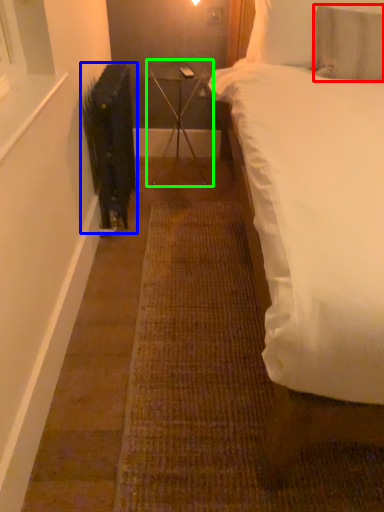
Question: Considering the real-world distances, which object is closest to pillow (highlighted by a red box)? radiator (highlighted by a blue box) or table (highlighted by a green box).

Choices:
 (A) radiator
 (B) table

Answer: (B)